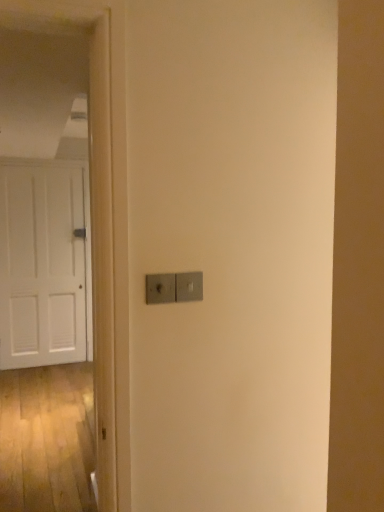
Question: Is satin silver switch at center, which appears as the first light switch when viewed from the right, inside satin silver switch at center, the 2th light switch from the right?

Choices:
 (A) no
 (B) yes

Answer: (A)

Question: Are satin silver switch at center, the 2th light switch from the right, and satin silver switch at center, which appears as the first light switch when viewed from the right, far apart?

Choices:
 (A) yes
 (B) no

Answer: (B)

Question: Is satin silver switch at center, the 2th light switch from the right, to the left of satin silver switch at center, which appears as the first light switch when viewed from the right, from the viewer's perspective?

Choices:
 (A) yes
 (B) no

Answer: (A)

Question: Is satin silver switch at center, the 2th light switch from the right, positioned with its back to satin silver switch at center, which appears as the first light switch when viewed from the right?

Choices:
 (A) yes
 (B) no

Answer: (B)

Question: Can you confirm if satin silver switch at center, the 2th light switch from the right, is taller than satin silver switch at center, which is counted as the 2th light switch, starting from the left?

Choices:
 (A) yes
 (B) no

Answer: (B)

Question: Is satin silver switch at center, which is counted as the 2th light switch, starting from the left, spatially inside satin silver switch at center, the 2th light switch from the right, or outside of it?

Choices:
 (A) outside
 (B) inside

Answer: (A)

Question: Based on their sizes in the image, would you say satin silver switch at center, which appears as the first light switch when viewed from the right, is bigger or smaller than satin silver switch at center, the 2th light switch from the right?

Choices:
 (A) big
 (B) small

Answer: (B)

Question: Is satin silver switch at center, which appears as the first light switch when viewed from the right, wider or thinner than satin silver switch at center, the 2th light switch from the right?

Choices:
 (A) thin
 (B) wide

Answer: (A)

Question: Would you say satin silver switch at center, which is counted as the 2th light switch, starting from the left, is to the left or to the right of satin silver switch at center, the 2th light switch from the right, in the picture?

Choices:
 (A) right
 (B) left

Answer: (A)

Question: Is satin silver switch at center, the 2th light switch from the right, wider or thinner than satin silver switch at center, which is counted as the 2th light switch, starting from the left?

Choices:
 (A) wide
 (B) thin

Answer: (A)

Question: Visually, is satin silver switch at center, the 2th light switch from the right, positioned to the left or to the right of satin silver switch at center, which is counted as the 2th light switch, starting from the left?

Choices:
 (A) left
 (B) right

Answer: (A)

Question: Considering the positions of satin silver switch at center, which ranks as the first light switch in left-to-right order, and satin silver switch at center, which appears as the first light switch when viewed from the right, in the image, is satin silver switch at center, which ranks as the first light switch in left-to-right order, taller or shorter than satin silver switch at center, which appears as the first light switch when viewed from the right,?

Choices:
 (A) tall
 (B) short

Answer: (B)

Question: In the image, is satin silver switch at center, the 2th light switch from the right, positioned in front of or behind satin silver switch at center, which is counted as the 2th light switch, starting from the left?

Choices:
 (A) behind
 (B) front

Answer: (B)

Question: Do you think satin silver switch at center, which is counted as the 2th light switch, starting from the left, is within white matte door at left, or outside of it?

Choices:
 (A) outside
 (B) inside

Answer: (A)

Question: Is satin silver switch at center, which is counted as the 2th light switch, starting from the left, wider or thinner than white matte door at left?

Choices:
 (A) wide
 (B) thin

Answer: (B)